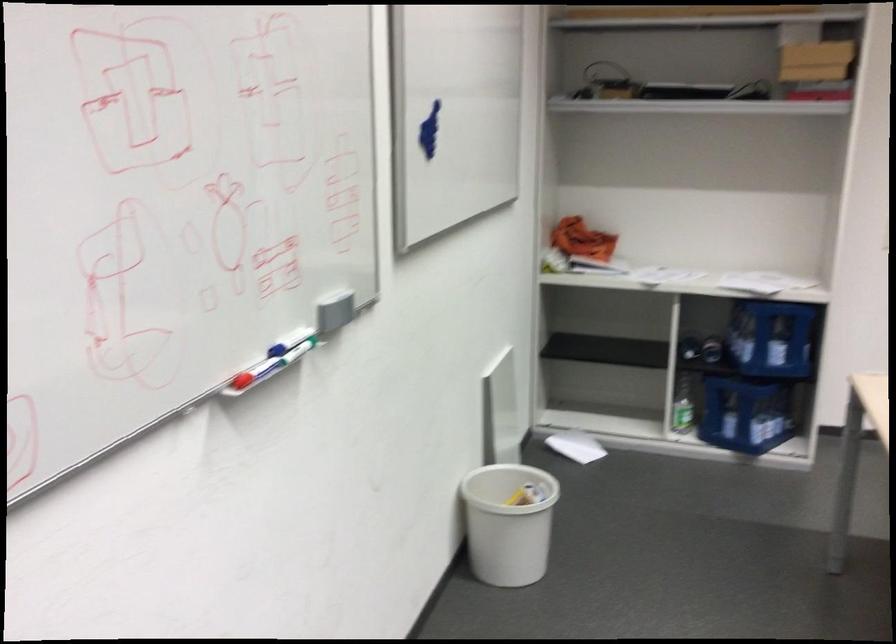
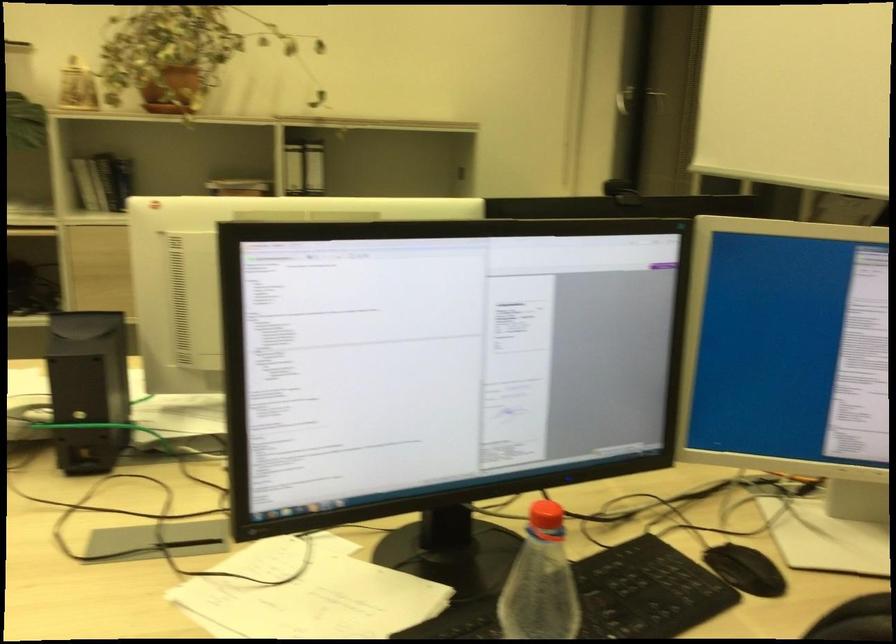
From the picture: The images are taken continuously from a first-person perspective. In which direction is your viewpoint rotating?

The camera's rotation is toward right-down.